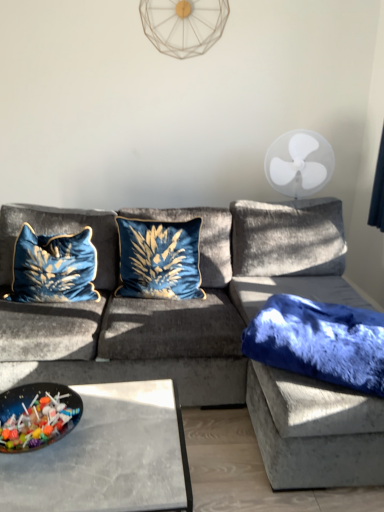
Question: Does glossy plastic bowl of candy at lower left have a lesser width compared to white plastic fan at upper center, placed as the 1th mechanical fan when sorted from top to bottom?

Choices:
 (A) yes
 (B) no

Answer: (B)

Question: From the image's perspective, does glossy plastic bowl of candy at lower left appear lower than white plastic fan at upper center, placed as the 1th mechanical fan when sorted from top to bottom?

Choices:
 (A) yes
 (B) no

Answer: (A)

Question: Can you see glossy plastic bowl of candy at lower left touching white plastic fan at upper center, placed as the 1th mechanical fan when sorted from top to bottom?

Choices:
 (A) yes
 (B) no

Answer: (B)

Question: Is glossy plastic bowl of candy at lower left to the right of white plastic fan at upper center, the first mechanical fan from the left, from the viewer's perspective?

Choices:
 (A) no
 (B) yes

Answer: (A)

Question: From a real-world perspective, is glossy plastic bowl of candy at lower left on top of white plastic fan at upper center, placed as the 1th mechanical fan when sorted from top to bottom?

Choices:
 (A) yes
 (B) no

Answer: (B)

Question: From a real-world perspective, is glossy plastic bowl of candy at lower left positioned under white plastic fan at upper center, placed as the 1th mechanical fan when sorted from top to bottom, based on gravity?

Choices:
 (A) yes
 (B) no

Answer: (A)

Question: From the image's perspective, is velvet blue pillow at left, the third pillow viewed from the right, located beneath white plastic fan at upper right, which is the second mechanical fan from left to right?

Choices:
 (A) yes
 (B) no

Answer: (A)

Question: From a real-world perspective, does velvet blue pillow at left, which ranks as the first pillow in left-to-right order, stand above white plastic fan at upper right, the first mechanical fan when ordered from right to left?

Choices:
 (A) yes
 (B) no

Answer: (B)

Question: Is white plastic fan at upper right, which is the second mechanical fan from left to right, a part of velvet blue pillow at left, the third pillow viewed from the right?

Choices:
 (A) no
 (B) yes

Answer: (A)

Question: Is velvet blue pillow at left, which ranks as the first pillow in left-to-right order, not close to white plastic fan at upper right, which is the second mechanical fan from left to right?

Choices:
 (A) yes
 (B) no

Answer: (A)

Question: Is velvet blue pillow at left, the third pillow viewed from the right, smaller than white plastic fan at upper right, acting as the first mechanical fan starting from the bottom?

Choices:
 (A) no
 (B) yes

Answer: (B)

Question: Can you confirm if velvet blue pillow at left, which ranks as the first pillow in left-to-right order, is taller than white plastic fan at upper right, the first mechanical fan when ordered from right to left?

Choices:
 (A) no
 (B) yes

Answer: (A)

Question: Is white plastic fan at upper right, the first mechanical fan when ordered from right to left, oriented towards velvet blue couch at center?

Choices:
 (A) no
 (B) yes

Answer: (B)